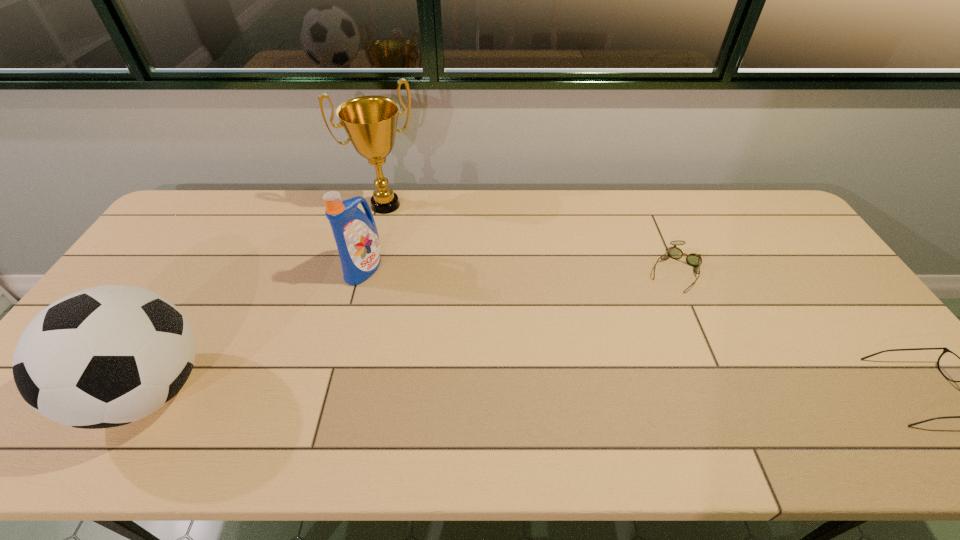
The image size is (960, 540). What are the coordinates of `vacant region at the far edge of the desktop` in the screenshot? It's located at click(445, 222).

Where is `vacant space at the near edge`? This screenshot has width=960, height=540. vacant space at the near edge is located at coordinates (362, 380).

What are the coordinates of `vacant region at the left edge of the desktop` in the screenshot? It's located at (146, 275).

What are the coordinates of `free space at the right edge of the desktop` in the screenshot? It's located at (875, 352).

Where is `free location at the far left corner`? free location at the far left corner is located at coordinates (194, 201).

This screenshot has height=540, width=960. Find the location of `free space at the far right corner`. free space at the far right corner is located at coordinates (781, 213).

Locate an element on the screen. The height and width of the screenshot is (540, 960). free spot between the leftmost object and the left spectacles is located at coordinates (412, 330).

Image resolution: width=960 pixels, height=540 pixels. In order to click on vacant area that lies between the shorter spectacles and the tallest object in this screenshot , I will do `click(530, 237)`.

This screenshot has width=960, height=540. I want to click on blank region between the second object from right to left and the soccer ball, so click(412, 330).

Locate an element on the screen. The image size is (960, 540). vacant point located between the soccer ball and the award is located at coordinates (268, 298).